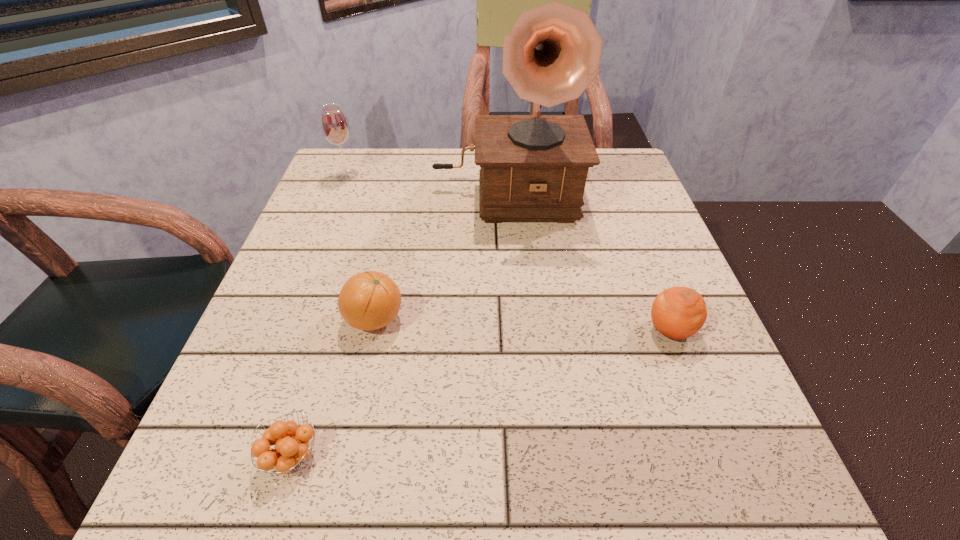
This screenshot has height=540, width=960. In the image, there is a desktop. Find the location of `free region at the right edge`. free region at the right edge is located at coordinates (620, 218).

The height and width of the screenshot is (540, 960). Identify the location of vacant space at the far left corner of the desktop. (372, 169).

Identify the location of vacant area at the far right corner. This screenshot has width=960, height=540. (607, 159).

This screenshot has width=960, height=540. I want to click on vacant space in between the rightmost orange fruit and the shortest orange fruit, so click(481, 393).

Find the location of a particular element. empty space between the wineglass and the record player is located at coordinates (426, 184).

Image resolution: width=960 pixels, height=540 pixels. What are the coordinates of `free space between the rightmost object and the nearest object` in the screenshot? It's located at pyautogui.click(x=481, y=393).

Identify the location of vacant space in between the rightmost object and the fourth object from left to right. (588, 261).

The height and width of the screenshot is (540, 960). I want to click on vacant area between the shortest orange fruit and the rightmost orange fruit, so click(481, 393).

At what (x,y) coordinates should I click in order to perform the action: click on free space between the shortest orange fruit and the rightmost orange fruit. Please return your answer as a coordinate pair (x, y). The height and width of the screenshot is (540, 960). Looking at the image, I should click on (481, 393).

This screenshot has width=960, height=540. I want to click on vacant area that lies between the record player and the rightmost object, so click(x=588, y=261).